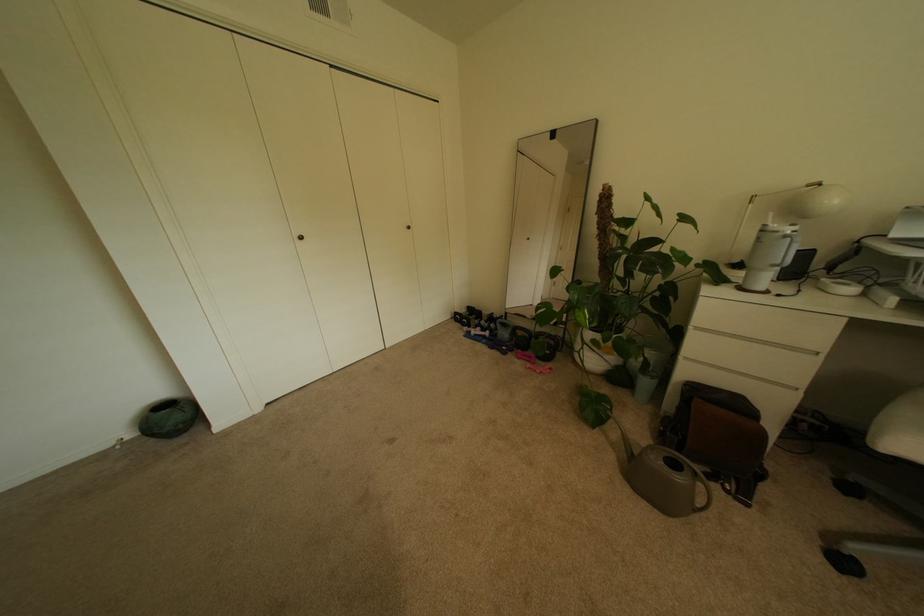
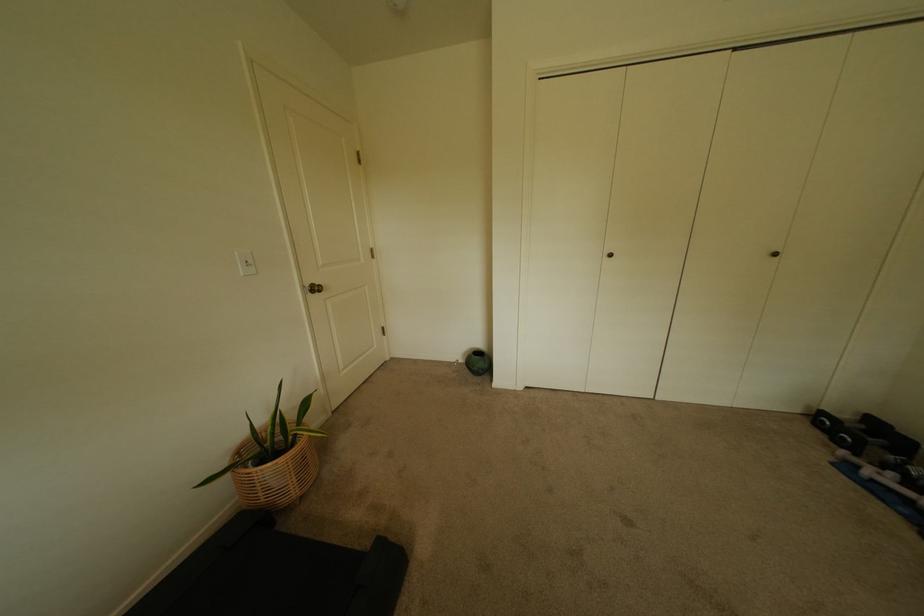
The point at (465, 315) is marked in the first image. Where is the corresponding point in the second image?

(831, 415)